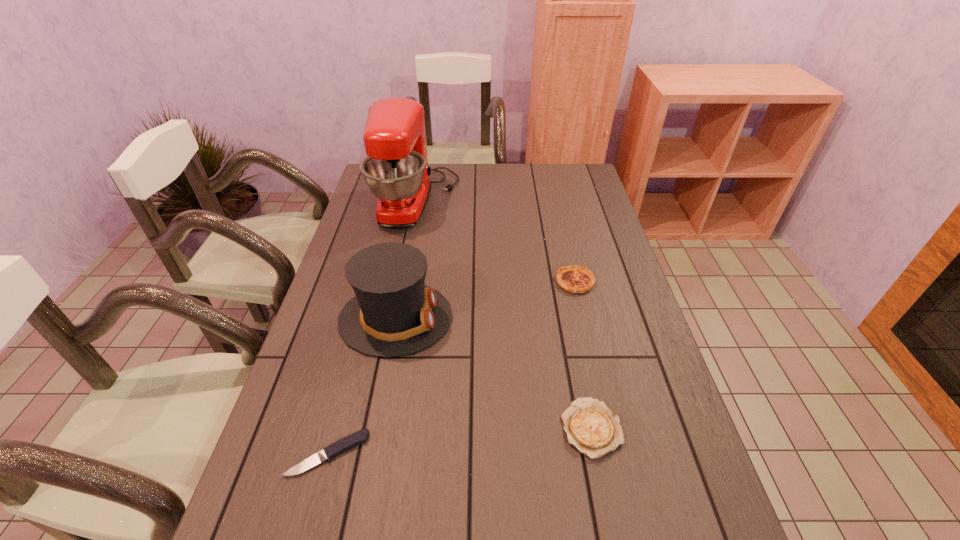
Where is `vacant space that satisfies the following two spatial constraints: 1. with goggles on the front of the fourth shortest object; 2. on the right side of the shorter quiche`? Image resolution: width=960 pixels, height=540 pixels. vacant space that satisfies the following two spatial constraints: 1. with goggles on the front of the fourth shortest object; 2. on the right side of the shorter quiche is located at coordinates (374, 428).

This screenshot has width=960, height=540. I want to click on blank space that satisfies the following two spatial constraints: 1. with goggles on the front of the second tallest object; 2. on the right side of the shorter quiche, so click(374, 428).

This screenshot has height=540, width=960. I want to click on vacant space that satisfies the following two spatial constraints: 1. on the back side of the steak knife; 2. on the right side of the third tallest object, so click(x=373, y=282).

At what (x,y) coordinates should I click in order to perform the action: click on free space that satisfies the following two spatial constraints: 1. on the back side of the shorter quiche; 2. on the left side of the steak knife. Please return your answer as a coordinate pair (x, y). Looking at the image, I should click on (335, 428).